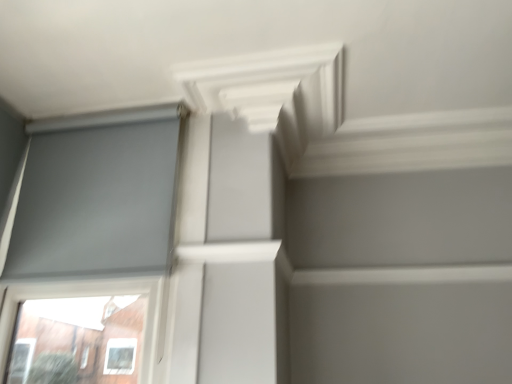
Question: Is white matte exhaust hood at upper center completely or partially outside of matte gray screen at left?

Choices:
 (A) yes
 (B) no

Answer: (A)

Question: From a real-world perspective, is white matte exhaust hood at upper center under matte gray screen at left?

Choices:
 (A) no
 (B) yes

Answer: (A)

Question: Is white matte exhaust hood at upper center at the left side of matte gray screen at left?

Choices:
 (A) yes
 (B) no

Answer: (B)

Question: Does white matte exhaust hood at upper center have a larger size compared to matte gray screen at left?

Choices:
 (A) no
 (B) yes

Answer: (A)

Question: Considering the relative sizes of white matte exhaust hood at upper center and matte gray screen at left in the image provided, is white matte exhaust hood at upper center smaller than matte gray screen at left?

Choices:
 (A) no
 (B) yes

Answer: (B)

Question: From the image's perspective, is white matte exhaust hood at upper center on top of matte gray screen at left?

Choices:
 (A) no
 (B) yes

Answer: (B)

Question: From the image's perspective, is matte gray screen at left located beneath white matte exhaust hood at upper center?

Choices:
 (A) no
 (B) yes

Answer: (B)

Question: Is matte gray screen at left far away from white matte exhaust hood at upper center?

Choices:
 (A) yes
 (B) no

Answer: (B)

Question: From the image's perspective, is matte gray screen at left on top of white matte exhaust hood at upper center?

Choices:
 (A) yes
 (B) no

Answer: (B)

Question: Is matte gray screen at left bigger than white matte exhaust hood at upper center?

Choices:
 (A) yes
 (B) no

Answer: (A)

Question: Would you say white matte exhaust hood at upper center is part of matte gray screen at left's contents?

Choices:
 (A) yes
 (B) no

Answer: (B)

Question: Is matte gray screen at left thinner than white matte exhaust hood at upper center?

Choices:
 (A) yes
 (B) no

Answer: (A)

Question: From a real-world perspective, is white matte exhaust hood at upper center above or below matte gray screen at left?

Choices:
 (A) below
 (B) above

Answer: (B)